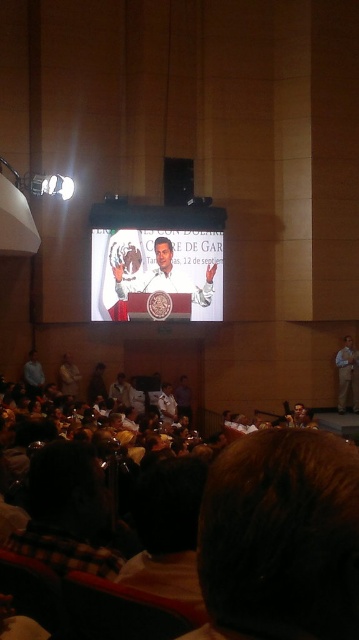
Question: Can you confirm if matte white podium at center is positioned to the right of khaki cotton pants at lower right?

Choices:
 (A) no
 (B) yes

Answer: (A)

Question: Which point is closer to the camera?

Choices:
 (A) khaki cotton pants at lower right
 (B) matte white podium at center

Answer: (B)

Question: Which of the following is the farthest from the observer?

Choices:
 (A) (151, 268)
 (B) (351, 392)

Answer: (B)

Question: Is matte white podium at center bigger than khaki cotton pants at lower right?

Choices:
 (A) no
 (B) yes

Answer: (B)

Question: Considering the relative positions of matte white podium at center and khaki cotton pants at lower right in the image provided, where is matte white podium at center located with respect to khaki cotton pants at lower right?

Choices:
 (A) left
 (B) right

Answer: (A)